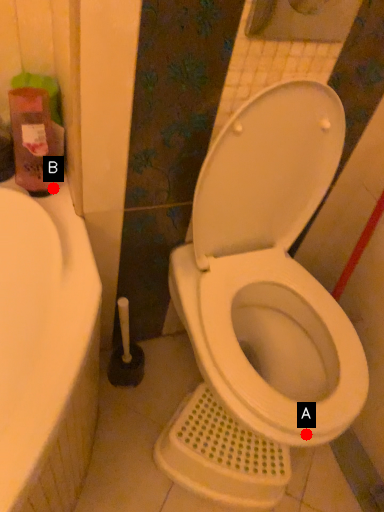
Question: Two points are circled on the image, labeled by A and B beside each circle. Which point is closer to the camera taking this photo?

Choices:
 (A) A is closer
 (B) B is closer

Answer: (A)